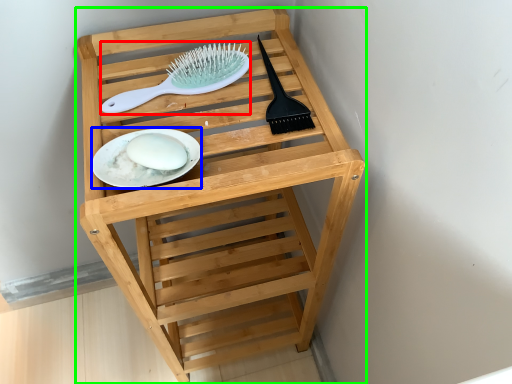
Question: Which object is the closest to the brush (highlighted by a red box)? Choose among these: plate (highlighted by a blue box) or furniture (highlighted by a green box).

Choices:
 (A) plate
 (B) furniture

Answer: (A)